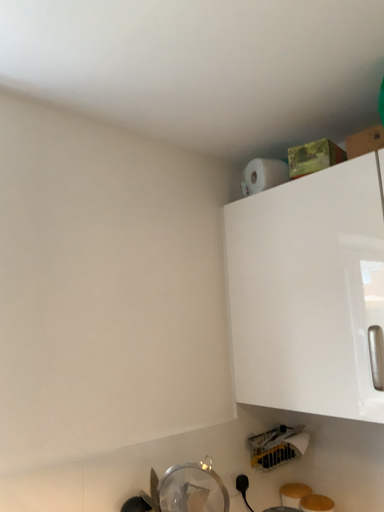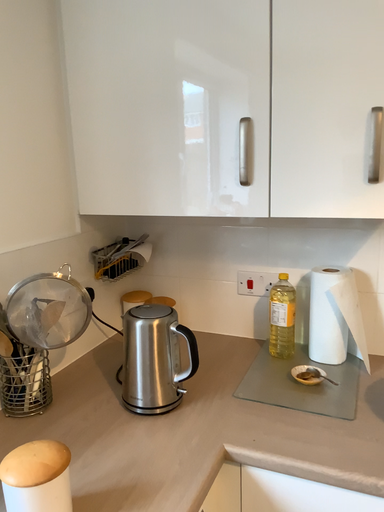
Question: Which way did the camera rotate in the video?

Choices:
 (A) rotated left
 (B) rotated right

Answer: (B)